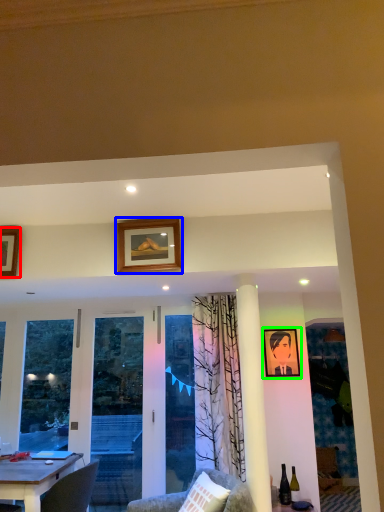
Question: Estimate the real-world distances between objects in this image. Which object is farther from picture frame (highlighted by a red box), picture frame (highlighted by a blue box) or picture frame (highlighted by a green box)?

Choices:
 (A) picture frame
 (B) picture frame

Answer: (B)